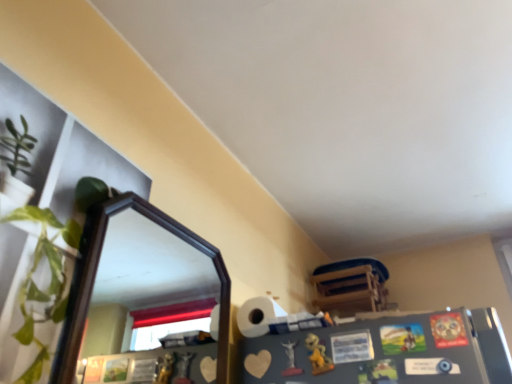
Question: Does black wooden mirror at upper left have a greater width compared to wooden chair at upper right?

Choices:
 (A) yes
 (B) no

Answer: (B)

Question: From the image's perspective, is black wooden mirror at upper left under wooden chair at upper right?

Choices:
 (A) yes
 (B) no

Answer: (B)

Question: Considering the relative sizes of black wooden mirror at upper left and wooden chair at upper right in the image provided, is black wooden mirror at upper left bigger than wooden chair at upper right?

Choices:
 (A) no
 (B) yes

Answer: (A)

Question: Considering the relative sizes of black wooden mirror at upper left and wooden chair at upper right in the image provided, is black wooden mirror at upper left taller than wooden chair at upper right?

Choices:
 (A) no
 (B) yes

Answer: (B)

Question: Is black wooden mirror at upper left located outside wooden chair at upper right?

Choices:
 (A) no
 (B) yes

Answer: (B)

Question: From their relative heights in the image, would you say matte plastic statue at lower center, positioned as the second toy in right-to-left order, is taller or shorter than wooden chair at upper right?

Choices:
 (A) tall
 (B) short

Answer: (B)

Question: Considering the positions of matte plastic statue at lower center, marked as the first toy in a left-to-right arrangement, and wooden chair at upper right in the image, is matte plastic statue at lower center, marked as the first toy in a left-to-right arrangement, wider or thinner than wooden chair at upper right?

Choices:
 (A) wide
 (B) thin

Answer: (B)

Question: From the image's perspective, is matte plastic statue at lower center, marked as the first toy in a left-to-right arrangement, above or below wooden chair at upper right?

Choices:
 (A) above
 (B) below

Answer: (A)

Question: Does point (287, 370) appear closer or farther from the camera than point (350, 299)?

Choices:
 (A) farther
 (B) closer

Answer: (B)

Question: Is matte plastic statue at lower center, marked as the first toy in a left-to-right arrangement, spatially inside yellow matte toy at lower center, placed as the first toy when sorted from right to left, or outside of it?

Choices:
 (A) inside
 (B) outside

Answer: (B)

Question: From a real-world perspective, is matte plastic statue at lower center, marked as the first toy in a left-to-right arrangement, physically located above or below yellow matte toy at lower center, placed as the first toy when sorted from right to left?

Choices:
 (A) below
 (B) above

Answer: (B)

Question: In the image, is matte plastic statue at lower center, positioned as the second toy in right-to-left order, on the left side or the right side of yellow matte toy at lower center, acting as the second toy starting from the left?

Choices:
 (A) right
 (B) left

Answer: (B)

Question: Looking at the image, does matte plastic statue at lower center, marked as the first toy in a left-to-right arrangement, seem bigger or smaller compared to yellow matte toy at lower center, acting as the second toy starting from the left?

Choices:
 (A) small
 (B) big

Answer: (A)

Question: Based on their sizes in the image, would you say yellow matte toy at lower center, acting as the second toy starting from the left, is bigger or smaller than wooden chair at upper right?

Choices:
 (A) small
 (B) big

Answer: (A)

Question: From the image's perspective, is yellow matte toy at lower center, placed as the first toy when sorted from right to left, located above or below wooden chair at upper right?

Choices:
 (A) below
 (B) above

Answer: (B)